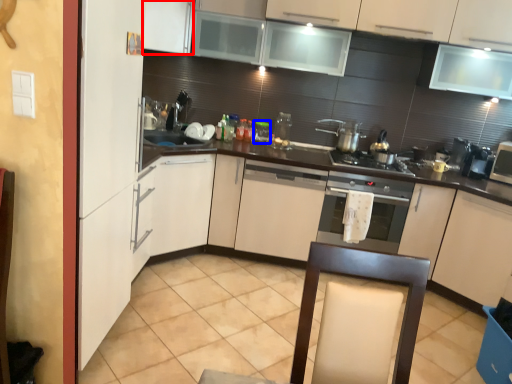
Question: Which of the following is the farthest to the observer, cabinetry (highlighted by a red box) or appliance (highlighted by a blue box)?

Choices:
 (A) cabinetry
 (B) appliance

Answer: (B)